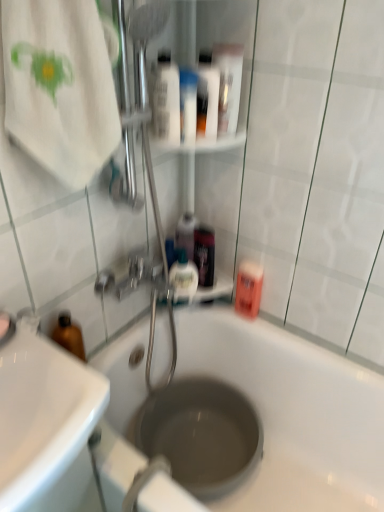
Question: Looking at the image, does white glossy mouthwash at upper center, the 7th mouthwash when ordered from bottom to top, seem bigger or smaller compared to white glossy sink at lower left?

Choices:
 (A) small
 (B) big

Answer: (A)

Question: Looking at their shapes, would you say white glossy mouthwash at upper center, which appears as the first mouthwash when viewed from the top, is wider or thinner than white glossy sink at lower left?

Choices:
 (A) thin
 (B) wide

Answer: (A)

Question: Estimate the real-world distances between objects in this image. Which object is farther from the white glossy sink at lower left?

Choices:
 (A) translucent plastic mouthwash at upper center, which appears as the sixth mouthwash when viewed from the top
 (B) white cotton towel at upper left
 (C) transparent plastic hole at center
 (D) translucent plastic mouthwash at upper center, which appears as the fifth mouthwash when viewed from the top
 (E) pink matte mouthwash at right, the 7th mouthwash viewed from the top

Answer: (E)

Question: Which is nearer to the white glossy mouthwash at upper center, the 7th mouthwash when ordered from bottom to top?

Choices:
 (A) white glossy mouthwash at upper center, which is the 2th mouthwash in top-to-bottom order
 (B) translucent plastic mouthwash at upper center, which appears as the fifth mouthwash when viewed from the top
 (C) transparent plastic hole at center
 (D) white glossy tube at upper center
 (E) translucent plastic mouthwash at center, acting as the fourth mouthwash starting from the bottom

Answer: (A)